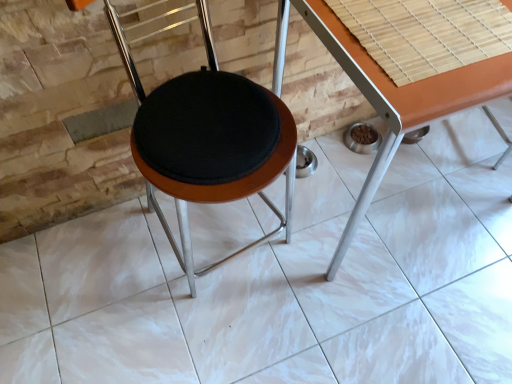
Identify the location of free space in front of black fabric cushion at center. Image resolution: width=512 pixels, height=384 pixels. (208, 341).